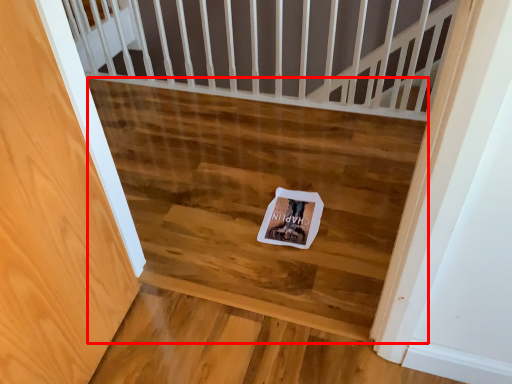
Question: From the image's perspective, where is stairwell (annotated by the red box) located in relation to postcard in the image?

Choices:
 (A) below
 (B) above

Answer: (B)